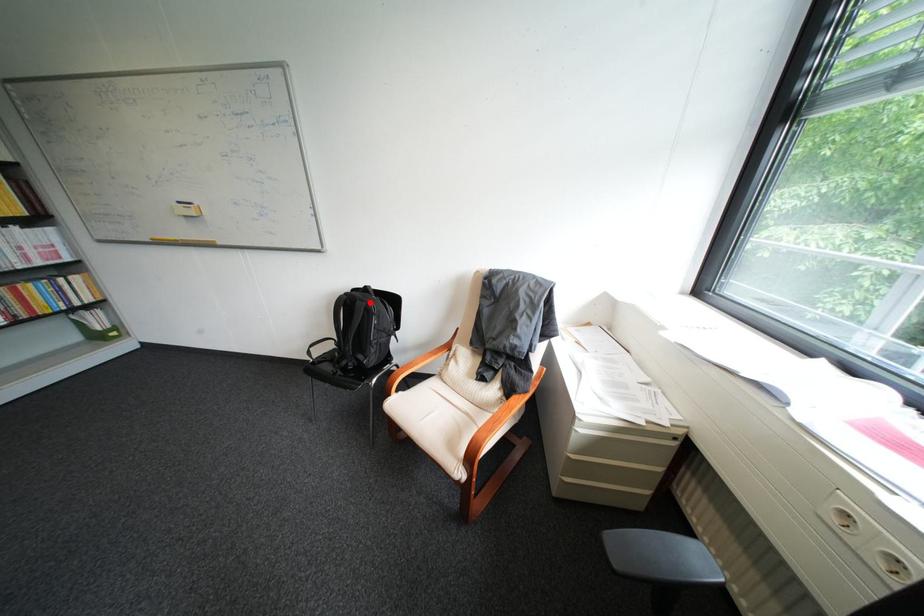
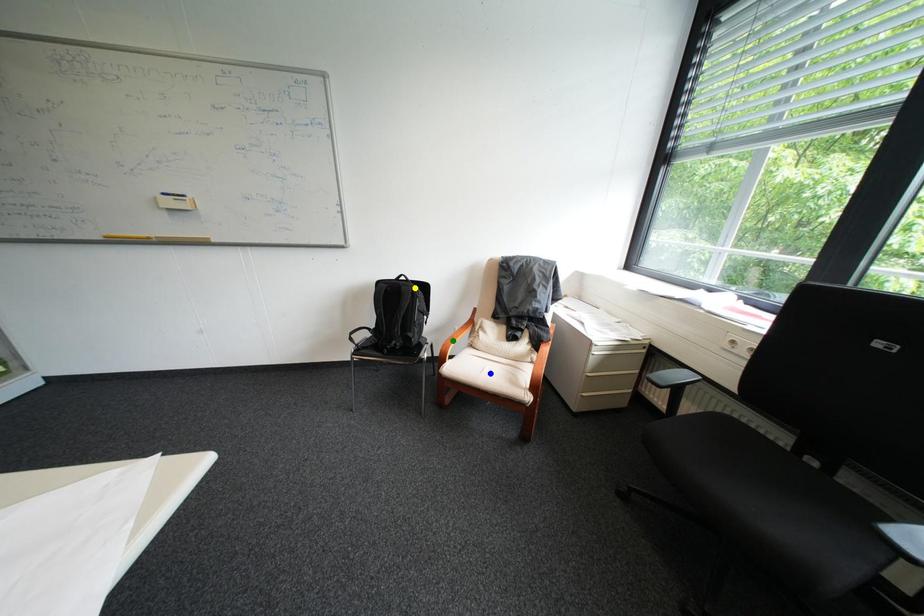
Question: I am providing you with two images of the same scene from different viewpoints. A red point is marked on the first image. You are given multiple points on the second image. In image 2, which mark is for the same physical point as the one in image 1?

Choices:
 (A) blue point
 (B) yellow point
 (C) green point

Answer: (B)